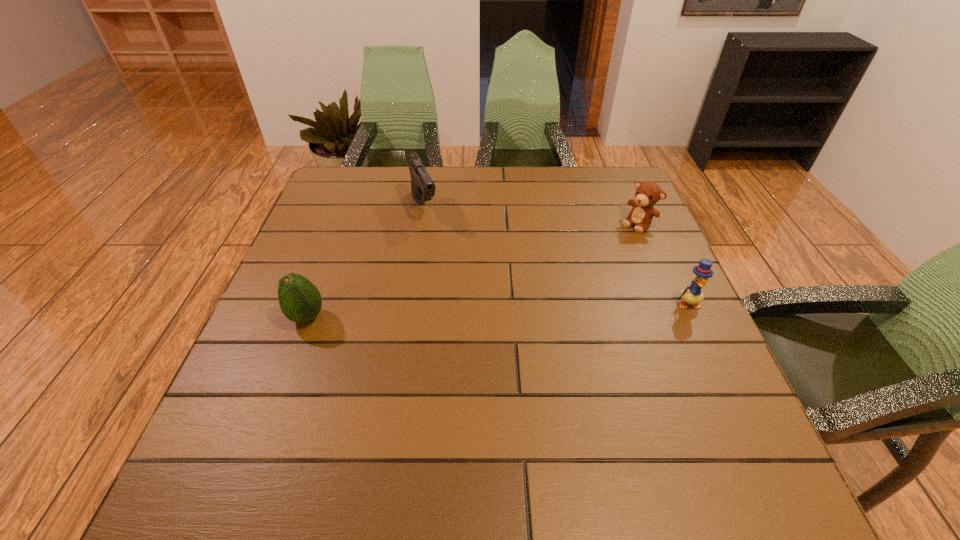
At what (x,y) coordinates should I click in order to perform the action: click on avocado. Please return your answer as a coordinate pair (x, y). The height and width of the screenshot is (540, 960). Looking at the image, I should click on (300, 301).

Identify the location of duckling. Image resolution: width=960 pixels, height=540 pixels. click(x=693, y=294).

At what (x,y) coordinates should I click in order to perform the action: click on teddy bear. Please return your answer as a coordinate pair (x, y). Looking at the image, I should click on tap(648, 193).

Where is `pistol`? Image resolution: width=960 pixels, height=540 pixels. pistol is located at coordinates (423, 189).

At what (x,y) coordinates should I click in order to perform the action: click on free spot located 0.270m on the back of the leftmost object. Please return your answer as a coordinate pair (x, y). The height and width of the screenshot is (540, 960). Looking at the image, I should click on (340, 230).

At what (x,y) coordinates should I click in order to perform the action: click on free space located on the face of the duckling, where the monocle is placed. Please return your answer as a coordinate pair (x, y). This screenshot has width=960, height=540. Looking at the image, I should click on (738, 415).

The height and width of the screenshot is (540, 960). I want to click on vacant position located 0.380m on the face of the teddy bear, so click(x=541, y=306).

I want to click on vacant space located on the face of the teddy bear, so click(555, 295).

The height and width of the screenshot is (540, 960). I want to click on free location located on the face of the teddy bear, so click(619, 240).

Find the location of a particular element. The height and width of the screenshot is (540, 960). vacant space positioned 0.130m at the barrel of the third object from right to left is located at coordinates pos(442,255).